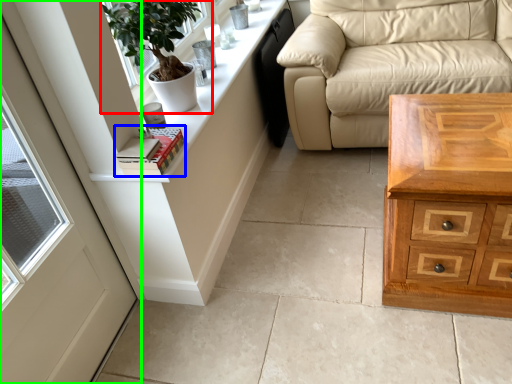
Question: Which object is the farthest from houseplant (highlighted by a red box)? Choose among these: book (highlighted by a blue box) or door (highlighted by a green box).

Choices:
 (A) book
 (B) door

Answer: (B)